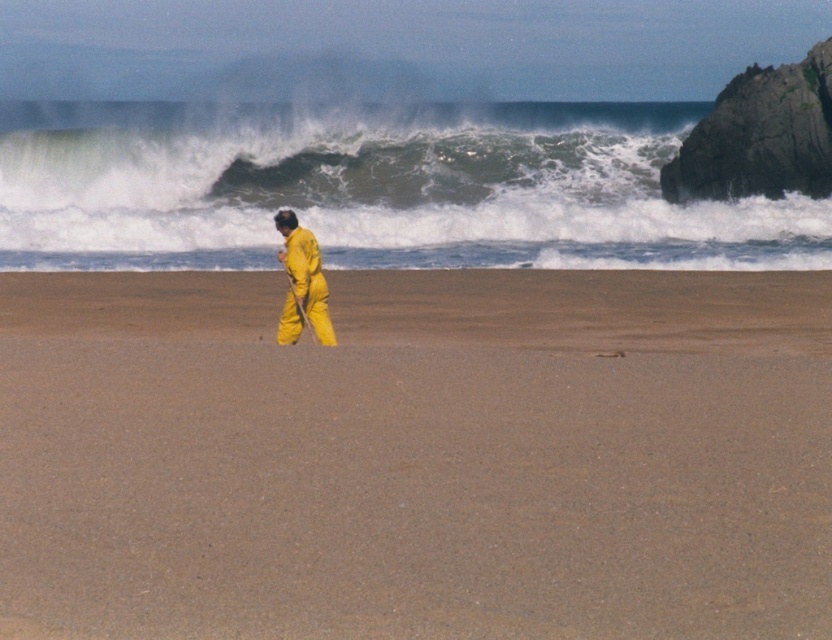
You are a GUI agent. You are given a task and a screenshot of the screen. Output one action in this format:
    pyautogui.click(x=<x>, y=<y>)
    Task: Click on the white frothy water at upper center
    
    Given the screenshot: What is the action you would take?
    pyautogui.click(x=375, y=188)

At what (x,y) coordinates should I click in order to perform the action: click on white frothy water at upper center. Please return your answer as a coordinate pair (x, y). Image resolution: width=832 pixels, height=640 pixels. Looking at the image, I should click on (375, 188).

Is smooth sand at center to the left of white frothy water at upper center from the viewer's perspective?

In fact, smooth sand at center is to the right of white frothy water at upper center.

From the picture: Who is taller, smooth sand at center or white frothy water at upper center?

With more height is white frothy water at upper center.

Image resolution: width=832 pixels, height=640 pixels. In order to click on smooth sand at center in this screenshot , I will do `click(418, 454)`.

Does smooth sand at center have a smaller size compared to yellow matte jumpsuit at center?

Actually, smooth sand at center might be larger than yellow matte jumpsuit at center.

From the picture: Between smooth sand at center and yellow matte jumpsuit at center, which one is positioned lower?

smooth sand at center

Between point (800, 365) and point (286, 212), which one is positioned in front?

Positioned in front is point (800, 365).

You are a GUI agent. You are given a task and a screenshot of the screen. Output one action in this format:
    pyautogui.click(x=<x>, y=<y>)
    Task: Click on the smooth sand at center
    Image resolution: width=832 pixels, height=640 pixels.
    Given the screenshot: What is the action you would take?
    pyautogui.click(x=418, y=454)